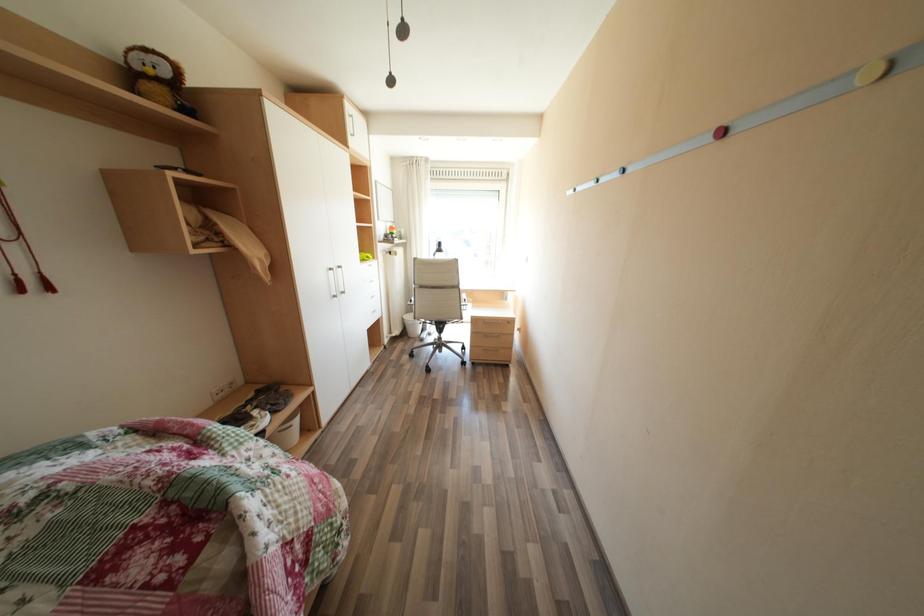
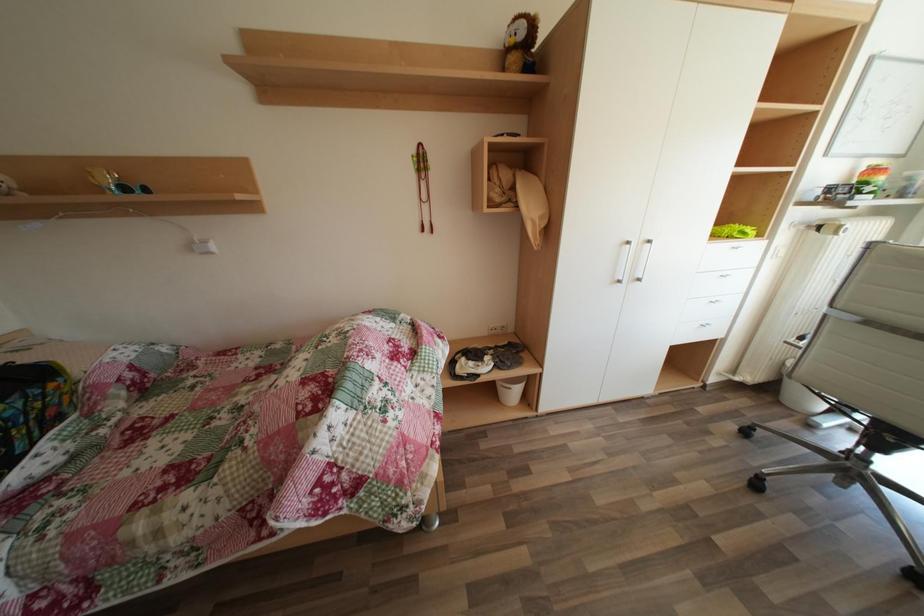
How did the camera likely rotate?

The rotation direction of the camera is left-down.